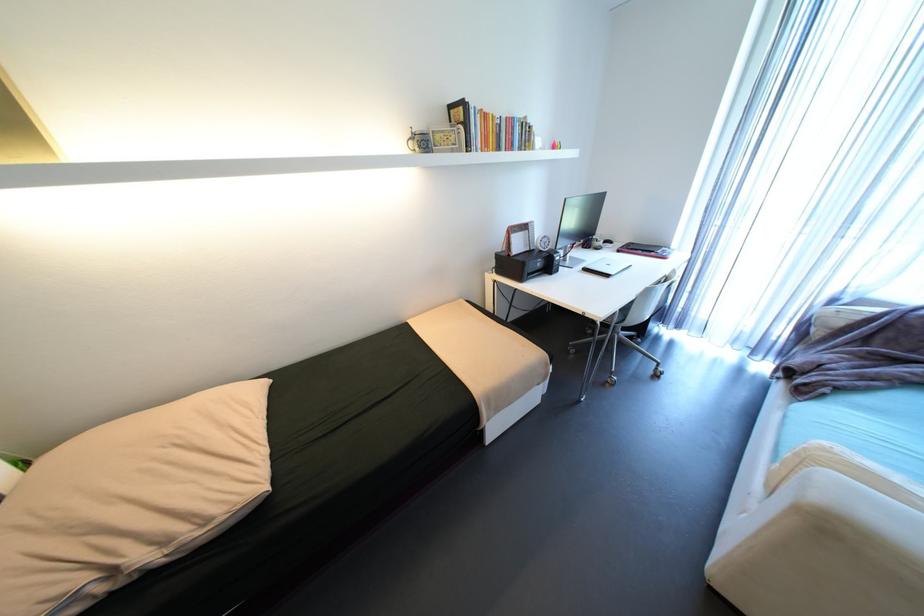
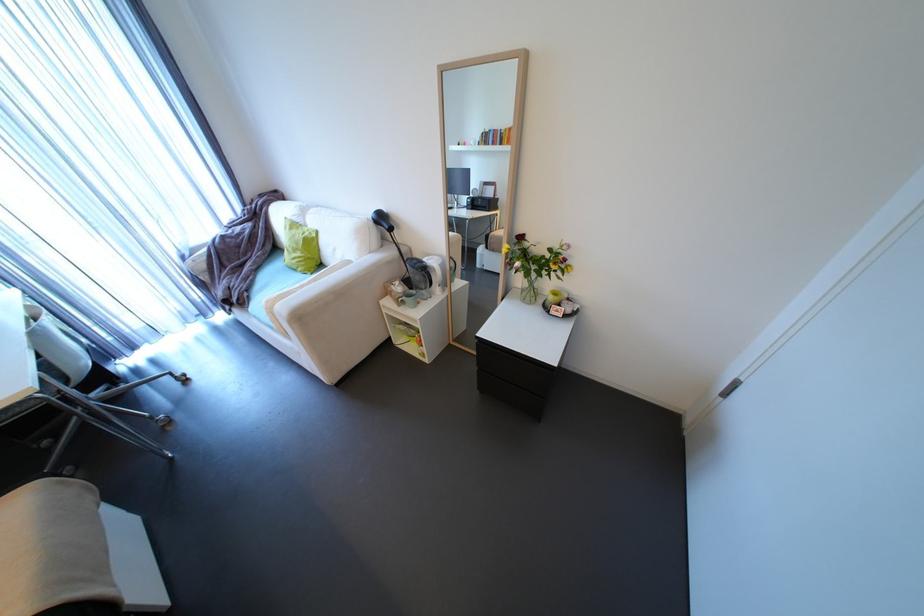
Where in the second image is the point corresponding to (592,315) from the first image?

(7, 408)